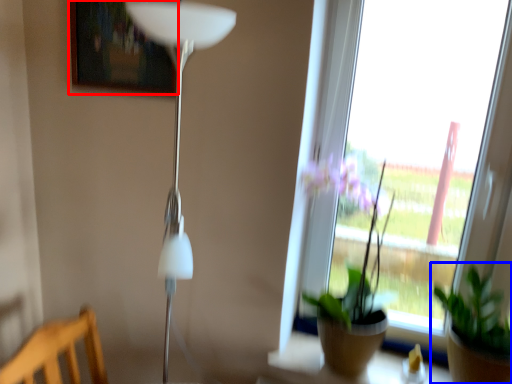
Question: Which object appears farthest to the camera in this image, picture frame (highlighted by a red box) or houseplant (highlighted by a blue box)?

Choices:
 (A) picture frame
 (B) houseplant

Answer: (A)